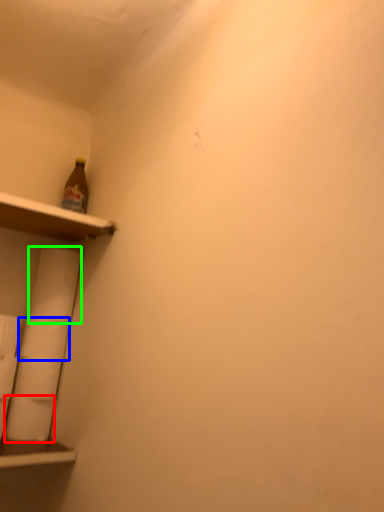
Question: Considering the real-world distances, which object is closest to toilet paper (highlighted by a red box)? toilet paper (highlighted by a blue box) or toilet paper (highlighted by a green box).

Choices:
 (A) toilet paper
 (B) toilet paper

Answer: (A)